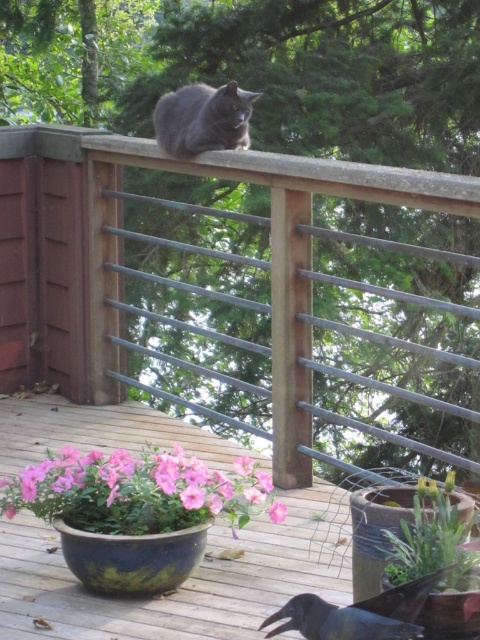
Question: Which point is farther to the camera?

Choices:
 (A) pink matte flower pot at lower left
 (B) shiny black crow at lower center
 (C) wooden deck at center
 (D) shiny gray cat at center

Answer: (D)

Question: Considering the relative positions of metallic gray fence at upper center and wooden deck at center in the image provided, where is metallic gray fence at upper center located with respect to wooden deck at center?

Choices:
 (A) right
 (B) left

Answer: (A)

Question: Which point is closer to the camera taking this photo?

Choices:
 (A) (25, 492)
 (B) (382, 598)
 (C) (279, 506)
 (D) (203, 627)

Answer: (B)

Question: Can you confirm if metallic gray fence at upper center is positioned to the right of shiny gray cat at center?

Choices:
 (A) no
 (B) yes

Answer: (B)

Question: Is pink matte flower pot at lower left wider than shiny black crow at lower center?

Choices:
 (A) yes
 (B) no

Answer: (A)

Question: Which point is farther to the camera?

Choices:
 (A) (396, 588)
 (B) (14, 444)
 (C) (176, 140)
 (D) (273, 518)

Answer: (B)